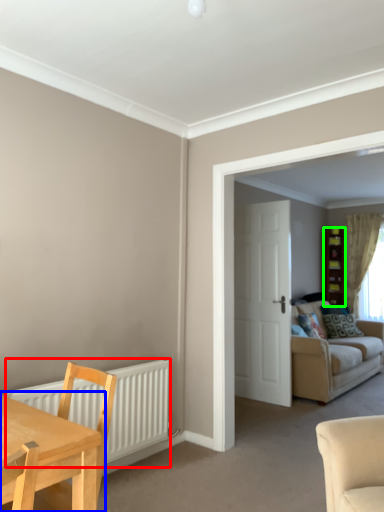
Question: Considering the real-world distances, which object is farthest from radiator (highlighted by a red box)? table (highlighted by a blue box) or cabinetry (highlighted by a green box)?

Choices:
 (A) table
 (B) cabinetry

Answer: (B)